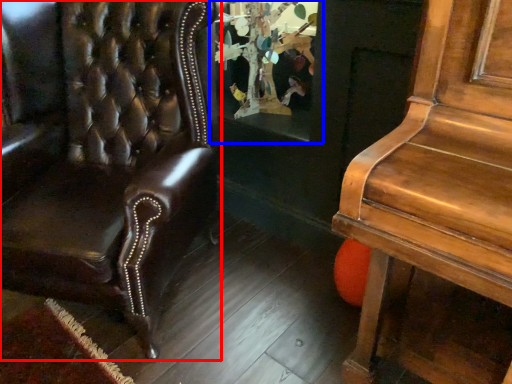
Question: Which object appears closest to the camera in this image, chair (highlighted by a red box) or shop window (highlighted by a blue box)?

Choices:
 (A) chair
 (B) shop window

Answer: (A)